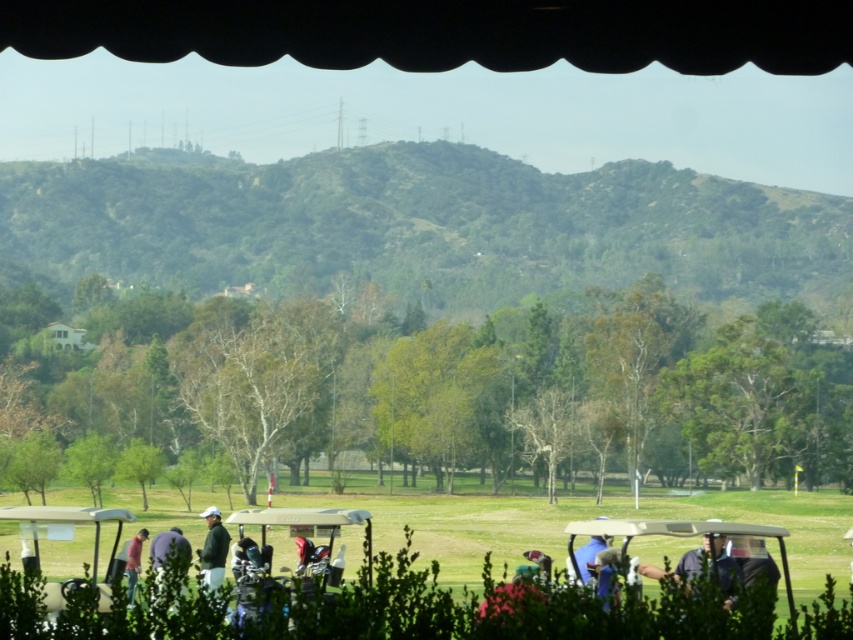
Question: Can you confirm if blue fabric shirt at lower right is thinner than pink fabric shirt at lower left?

Choices:
 (A) yes
 (B) no

Answer: (A)

Question: Which of the following is the farthest from the observer?

Choices:
 (A) (688, 556)
 (B) (270, 515)

Answer: (A)

Question: Does white plastic golf cart at center appear on the right side of green fabric golf bag at center?

Choices:
 (A) yes
 (B) no

Answer: (A)

Question: Which point is closer to the camera?

Choices:
 (A) (627, 540)
 (B) (341, 515)

Answer: (A)

Question: Among these points, which one is farthest from the camera?

Choices:
 (A) click(519, 570)
 (B) click(746, 604)
 (C) click(209, 538)

Answer: (C)

Question: Is green grassy golf course at center below green fabric golf bag at center?

Choices:
 (A) no
 (B) yes

Answer: (B)